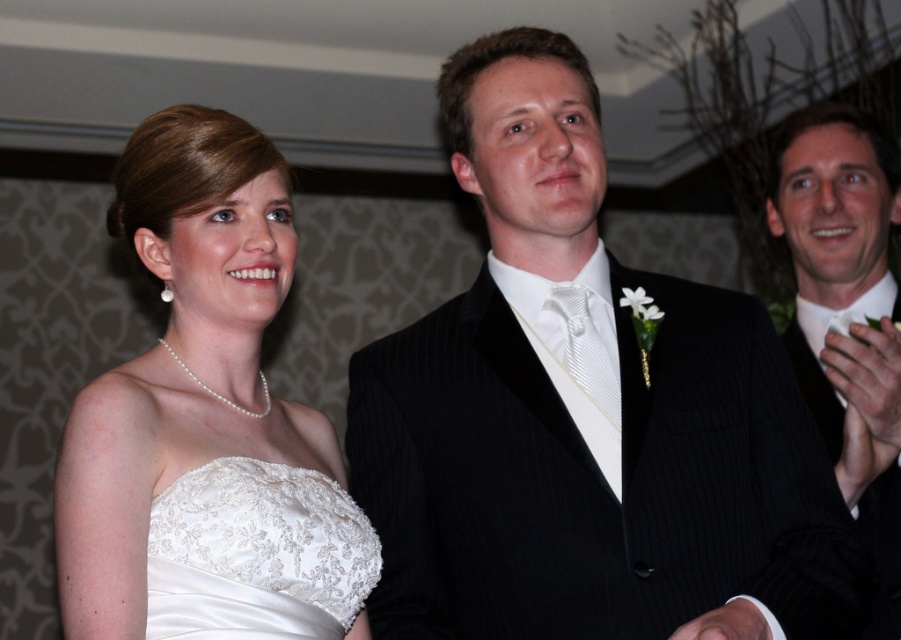
Who is more forward, (793, 236) or (348, 544)?

Point (348, 544) is more forward.

Is point (830, 186) closer to viewer compared to point (315, 520)?

No, (830, 186) is behind (315, 520).

I want to click on black pinstripe suit at right, so pos(845,312).

Identify the location of black pinstripe suit at right. (845, 312).

Can you confirm if white satin dress at left is wider than white lace dress at center?

Indeed, white satin dress at left has a greater width compared to white lace dress at center.

Is white satin dress at left thinner than white lace dress at center?

In fact, white satin dress at left might be wider than white lace dress at center.

Which is in front, point (241, 356) or point (267, 554)?

Point (267, 554) is more forward.

Where is `white satin dress at left`? Image resolution: width=901 pixels, height=640 pixels. white satin dress at left is located at coordinates click(x=180, y=356).

At what (x,y) coordinates should I click in order to perform the action: click on white satin dress at left. Please return your answer as a coordinate pair (x, y). Looking at the image, I should click on (180, 356).

Can you confirm if white satin dress at left is positioned below black pinstripe suit at right?

Indeed, white satin dress at left is positioned under black pinstripe suit at right.

The width and height of the screenshot is (901, 640). Find the location of `white satin dress at left`. white satin dress at left is located at coordinates (180, 356).

The width and height of the screenshot is (901, 640). Identify the location of white satin dress at left. (180, 356).